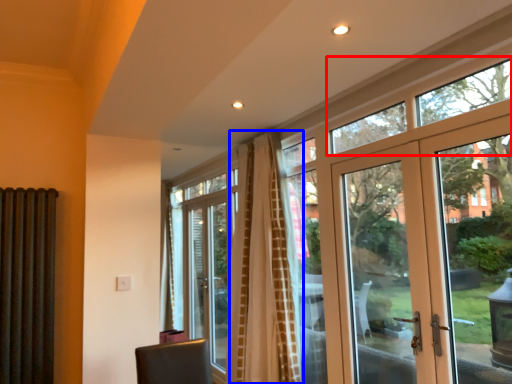
Question: Which of the following is the farthest to the observer, window (highlighted by a red box) or curtain (highlighted by a blue box)?

Choices:
 (A) window
 (B) curtain

Answer: (B)